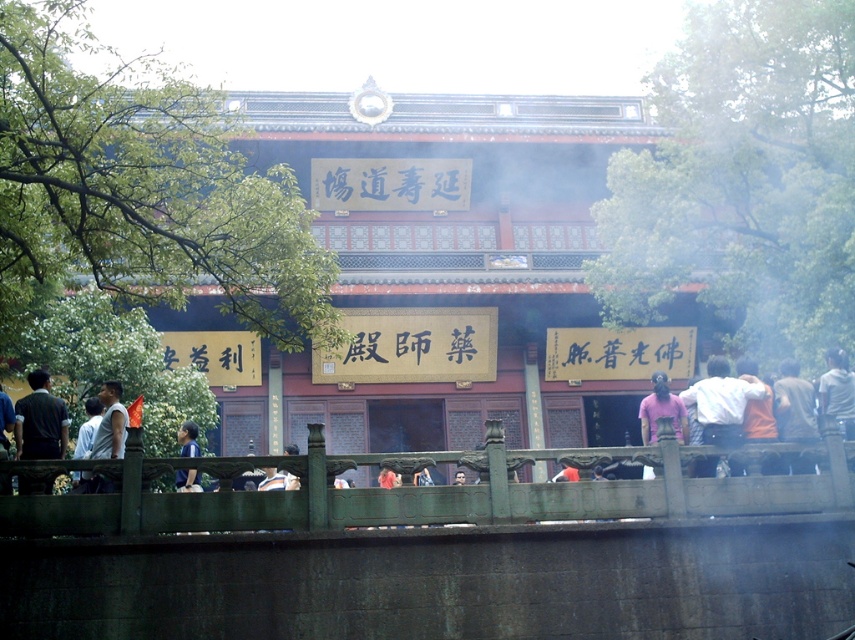
Is reddish-brown wooden temple at center above green stone railing at lower center?

Yes, reddish-brown wooden temple at center is above green stone railing at lower center.

The image size is (855, 640). I want to click on reddish-brown wooden temple at center, so click(440, 276).

Find the location of a particular element. This screenshot has width=855, height=640. reddish-brown wooden temple at center is located at coordinates (440, 276).

Does green stone railing at lower center come in front of pink fabric at center?

Yes, it is in front of pink fabric at center.

Is green stone railing at lower center taller than pink fabric at center?

No, green stone railing at lower center is not taller than pink fabric at center.

Does point (133, 509) come in front of point (647, 426)?

That is True.

You are a GUI agent. You are given a task and a screenshot of the screen. Output one action in this format:
    pyautogui.click(x=<x>, y=<y>)
    Task: Click on the green stone railing at lower center
    
    Given the screenshot: What is the action you would take?
    pyautogui.click(x=425, y=493)

I want to click on white matte tank top at lower left, so click(x=110, y=422).

Is point (121, 428) behind point (684, 426)?

That is False.

Identify the location of white matte tank top at lower left. The height and width of the screenshot is (640, 855). (110, 422).